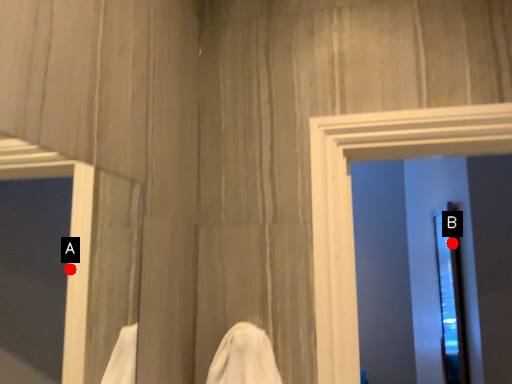
Question: Two points are circled on the image, labeled by A and B beside each circle. Among these points, which one is nearest to the camera?

Choices:
 (A) A is closer
 (B) B is closer

Answer: (A)